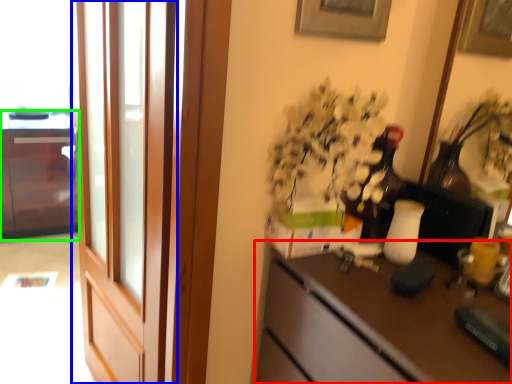
Question: Estimate the real-world distances between objects in this image. Which object is farther from desk (highlighted by a red box), screen door (highlighted by a blue box) or cabinetry (highlighted by a green box)?

Choices:
 (A) screen door
 (B) cabinetry

Answer: (B)